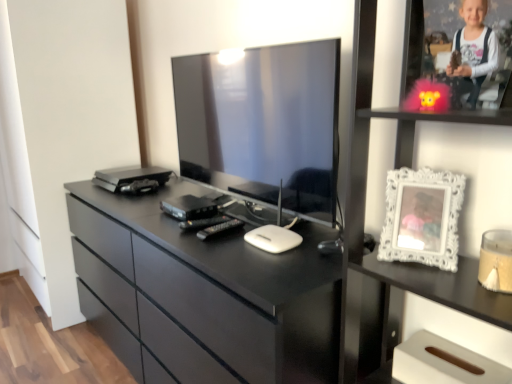
Question: From a real-world perspective, is white glossy picture frame at upper right located beneath satin black device at center?

Choices:
 (A) yes
 (B) no

Answer: (B)

Question: Considering the relative positions of white glossy picture frame at upper right and satin black device at center in the image provided, is white glossy picture frame at upper right to the right of satin black device at center from the viewer's perspective?

Choices:
 (A) yes
 (B) no

Answer: (A)

Question: Considering the relative sizes of white glossy picture frame at upper right and satin black device at center in the image provided, is white glossy picture frame at upper right bigger than satin black device at center?

Choices:
 (A) no
 (B) yes

Answer: (B)

Question: Does white glossy picture frame at upper right have a lesser height compared to satin black device at center?

Choices:
 (A) yes
 (B) no

Answer: (B)

Question: Would you say white glossy picture frame at upper right contains satin black device at center?

Choices:
 (A) no
 (B) yes

Answer: (A)

Question: From the image's perspective, is black glossy chest of drawers at center above or below white glossy picture frame at upper right?

Choices:
 (A) below
 (B) above

Answer: (A)

Question: Considering the relative positions of black glossy chest of drawers at center and white glossy picture frame at upper right in the image provided, is black glossy chest of drawers at center to the left or to the right of white glossy picture frame at upper right?

Choices:
 (A) left
 (B) right

Answer: (A)

Question: From a real-world perspective, is black glossy chest of drawers at center physically located above or below white glossy picture frame at upper right?

Choices:
 (A) above
 (B) below

Answer: (B)

Question: Considering the positions of point (128, 235) and point (460, 117), is point (128, 235) closer or farther from the camera than point (460, 117)?

Choices:
 (A) closer
 (B) farther

Answer: (B)

Question: Looking at their shapes, would you say black glossy chest of drawers at center is wider or thinner than satin black device at center?

Choices:
 (A) wide
 (B) thin

Answer: (A)

Question: Is black glossy chest of drawers at center in front of or behind satin black device at center in the image?

Choices:
 (A) behind
 (B) front

Answer: (B)

Question: Considering the positions of black glossy chest of drawers at center and satin black device at center in the image, is black glossy chest of drawers at center bigger or smaller than satin black device at center?

Choices:
 (A) big
 (B) small

Answer: (A)

Question: From a real-world perspective, relative to satin black device at center, is black glossy chest of drawers at center vertically above or below?

Choices:
 (A) above
 (B) below

Answer: (B)

Question: Is point (448, 210) positioned closer to the camera than point (394, 268)?

Choices:
 (A) farther
 (B) closer

Answer: (B)

Question: Is white ornate frame at right inside the boundaries of white glossy picture frame at upper right, or outside?

Choices:
 (A) inside
 (B) outside

Answer: (A)